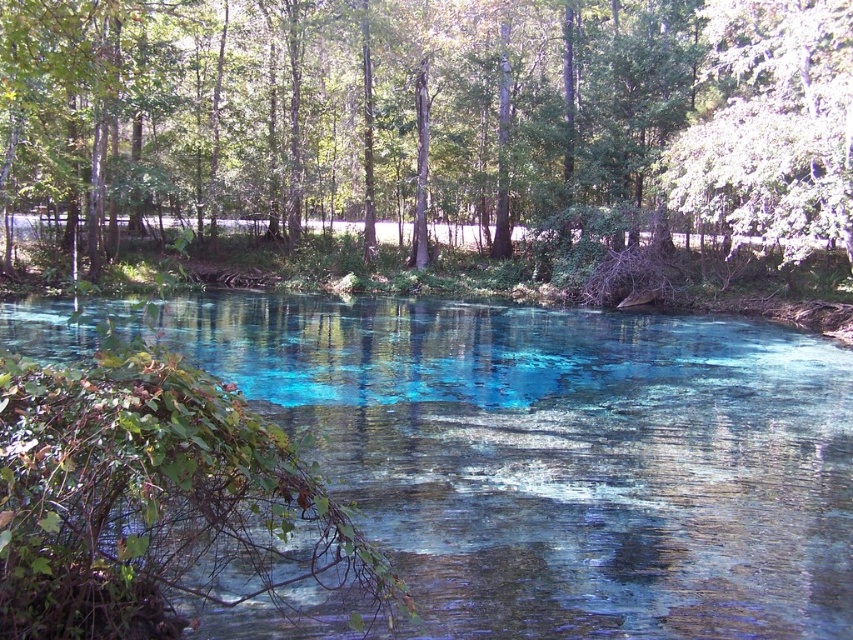
You are a photographer standing at the edge of the water in the scene. You want to capture both point (750, 38) and point (718, 170) in your photo. Which point will appear closer to the front of the image?

Point (750, 38) is further to the camera than point (718, 170), so it will appear closer to the front of the image.

You are standing at the edge of the water in the scene. If you want to walk directly towards the green leafy tree at center, which direction should you head?

Since the green leafy tree at center is located at point coordinates of 0.175 on the x axis and 0.506 on the y axis, you should head towards the center of the image to reach it.